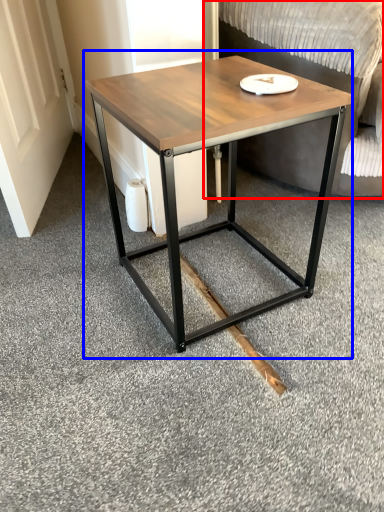
Question: Which object is further to the camera taking this photo, swivel chair (highlighted by a red box) or coffee table (highlighted by a blue box)?

Choices:
 (A) swivel chair
 (B) coffee table

Answer: (A)